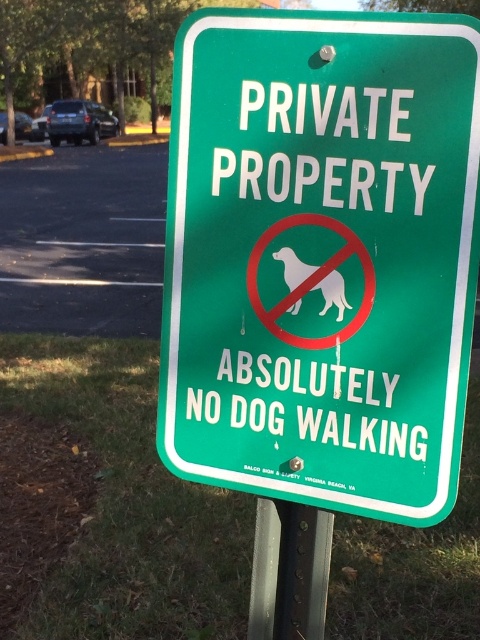
You are a delivery person approaching the green plastic sign at center and the green metallic pole at lower center. Which object is closer to you as you face the scene?

The green plastic sign at center is closer to you because it is in front of the green metallic pole at lower center.

You are a delivery driver who needs to park your vehicle in the parking lot. You see the green plastic sign at center and the green metallic pole at lower center. Which object is larger in size?

The green plastic sign at center is bigger than the green metallic pole at lower center.

From the picture: You are a dog owner trying to walk your dog in the parking area. You see the green plastic sign at center and the white paper dog at center. According to the sign, is it allowed to walk your dog here?

The green plastic sign at center is above the white paper dog at center, indicating that the prohibition symbol on the sign applies to the dog. Therefore, it is not allowed to walk your dog here.